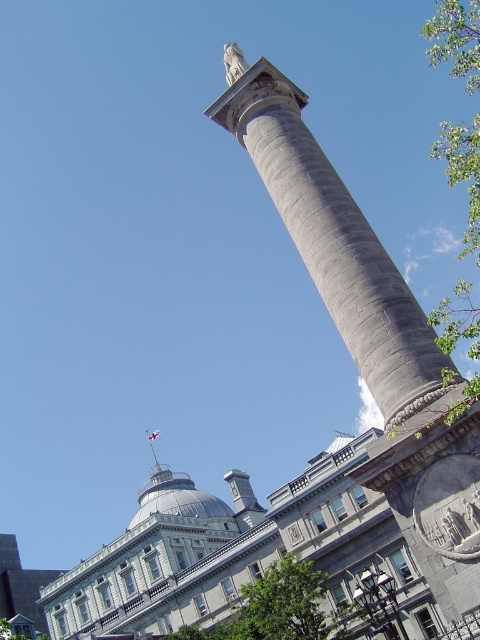
Question: Which is farther from the green leafy tree at lower center?

Choices:
 (A) gray stone column at center
 (B) green leafy tree at right

Answer: (B)

Question: Which point appears closest to the camera in this image?

Choices:
 (A) (206, 628)
 (B) (467, 387)
 (C) (323, 154)

Answer: (B)

Question: Which point appears farthest from the camera in this image?

Choices:
 (A) (355, 612)
 (B) (450, 342)

Answer: (A)

Question: Can you confirm if gray stone column at center is positioned to the left of green leafy tree at right?

Choices:
 (A) no
 (B) yes

Answer: (B)

Question: Where is gray stone column at center located in relation to green leafy tree at lower center in the image?

Choices:
 (A) above
 (B) below

Answer: (A)

Question: Does gray stone column at center appear on the left side of green leafy tree at lower center?

Choices:
 (A) no
 (B) yes

Answer: (A)